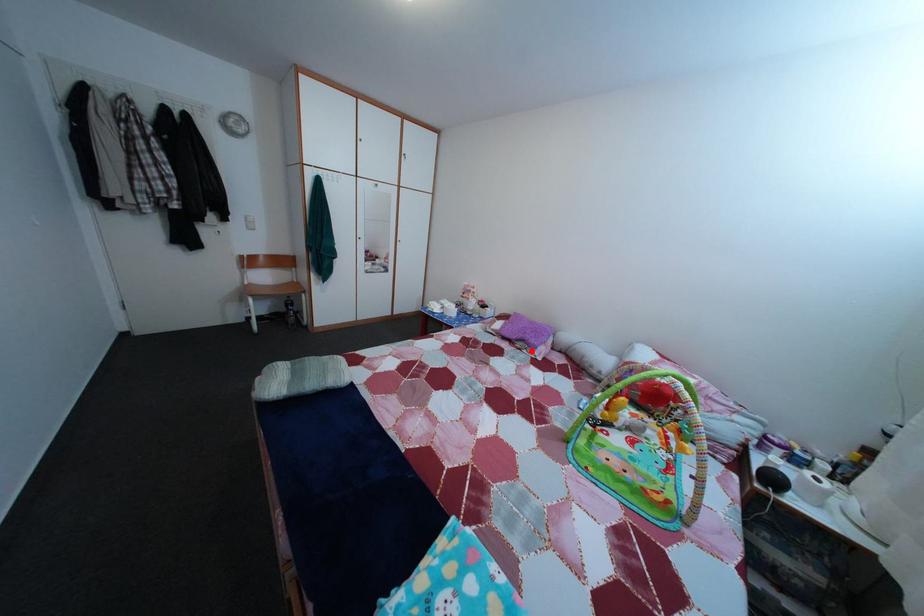
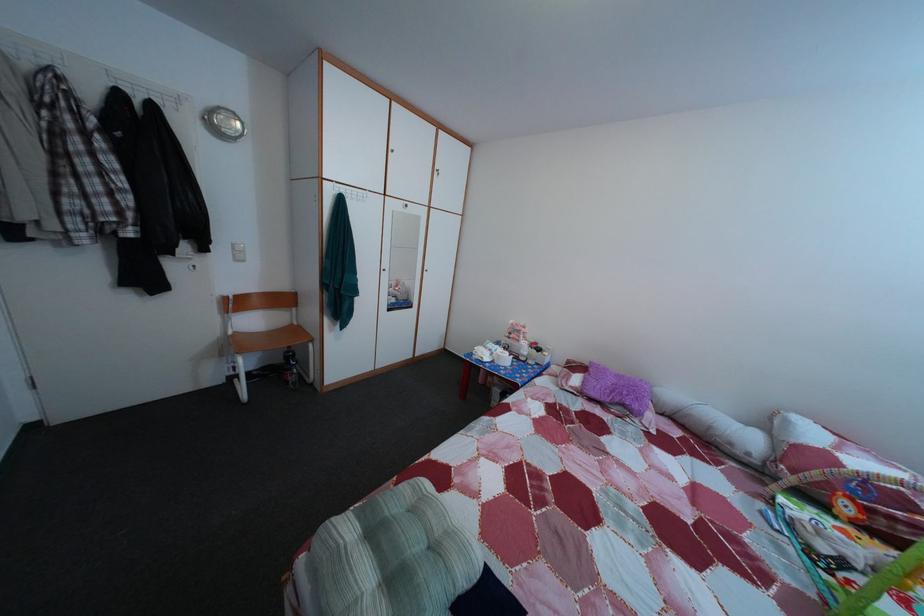
Question: I am providing you with two images of the same scene from different viewpoints. Given a red point in image1, look at the same physical point in image2. Is it:

Choices:
 (A) Closer to the viewpoint
 (B) Farther from the viewpoint

Answer: (A)